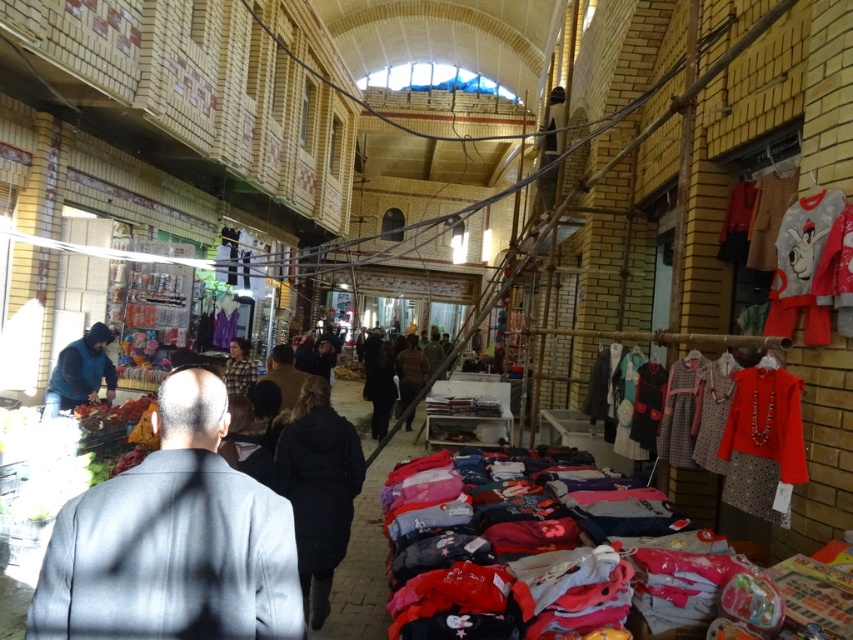
You are standing in the market and want to take a photo of both the children clothing rack and the toys. The children clothing rack is located at point (x=724, y=380) and the toys are at point (x=407, y=416). Which object should you focus on first to ensure both are in focus?

You should focus on the children clothing rack at point (x=724, y=380) first because it is closer to the camera than the toys at point (x=407, y=416). This way, both objects will be in focus as the toys are further away.

You are a customer in the market and want to try on both the dark gray suit at left and the brown fuzzy coat at center. If your arms are 0.5 meters wide, can you comfortably walk between them to reach the coat first?

The dark gray suit at left and brown fuzzy coat at center are 3.82 meters apart from each other. Since the distance between them is much wider than your arm span of 0.5 meters, you can comfortably walk between them to reach the coat first.